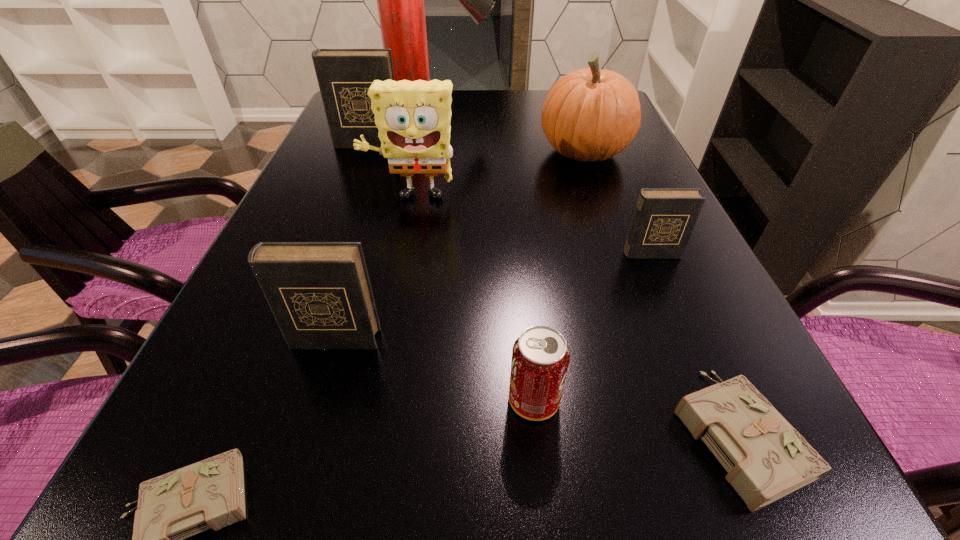
You are a GUI agent. You are given a task and a screenshot of the screen. Output one action in this format:
    pyautogui.click(x=<x>, y=<y>)
    Task: Click on the farthest object
    
    Given the screenshot: What is the action you would take?
    pyautogui.click(x=400, y=0)

You are a GUI agent. You are given a task and a screenshot of the screen. Output one action in this format:
    pyautogui.click(x=<x>, y=<y>)
    Task: Click on the fire extinguisher
    The height and width of the screenshot is (540, 960).
    Given the screenshot: What is the action you would take?
    pyautogui.click(x=400, y=0)

You are a GUI agent. You are given a task and a screenshot of the screen. Output one action in this format:
    pyautogui.click(x=<x>, y=<y>)
    Task: Click on the pumpkin
    Image resolution: width=960 pixels, height=540 pixels.
    Given the screenshot: What is the action you would take?
    pyautogui.click(x=589, y=114)

Locate an element on the screen. The height and width of the screenshot is (540, 960). the fourth farthest object is located at coordinates (413, 117).

This screenshot has height=540, width=960. In order to click on yellow sponge in this screenshot , I will do `click(413, 117)`.

Locate an element on the screen. the tallest diary is located at coordinates (344, 76).

The width and height of the screenshot is (960, 540). What are the coordinates of `the farthest diary` in the screenshot? It's located at (344, 76).

Where is `the third nearest diary`? The width and height of the screenshot is (960, 540). the third nearest diary is located at coordinates (320, 294).

You are a GUI agent. You are given a task and a screenshot of the screen. Output one action in this format:
    pyautogui.click(x=<x>, y=<y>)
    Task: Click on the second tallest diary
    Image resolution: width=960 pixels, height=540 pixels.
    Given the screenshot: What is the action you would take?
    pyautogui.click(x=320, y=294)

Find the location of `the fifth farthest object`. the fifth farthest object is located at coordinates (664, 219).